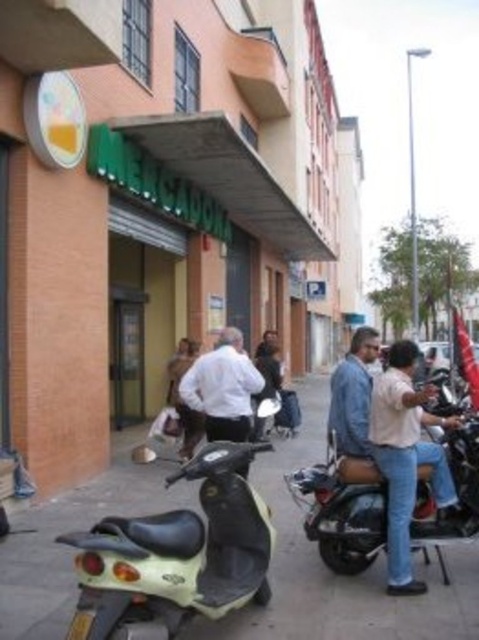
Is point (64, 595) closer to viewer compared to point (462, 529)?

Yes, point (64, 595) is closer to viewer.

Which is behind, point (289, 556) or point (306, 516)?

Positioned behind is point (289, 556).

What are the coordinates of `smooth concrete pavement at center` in the screenshot? It's located at (341, 577).

Is point (29, 541) in front of point (211, 358)?

Yes.

Is smooth concrete pavement at center thinner than white matte shirt at center?

No.

Locate an element on the screen. smooth concrete pavement at center is located at coordinates (341, 577).

Locate an element on the screen. This screenshot has width=479, height=640. smooth concrete pavement at center is located at coordinates (341, 577).

Does metallic silver scooter at lower right have a smaller size compared to denim jeans at lower right?

Yes, metallic silver scooter at lower right is smaller than denim jeans at lower right.

Does metallic silver scooter at lower right have a lesser width compared to denim jeans at lower right?

Yes.

I want to click on metallic silver scooter at lower right, so click(x=342, y=509).

Where is `metallic silver scooter at lower right`? This screenshot has height=640, width=479. metallic silver scooter at lower right is located at coordinates (342, 509).